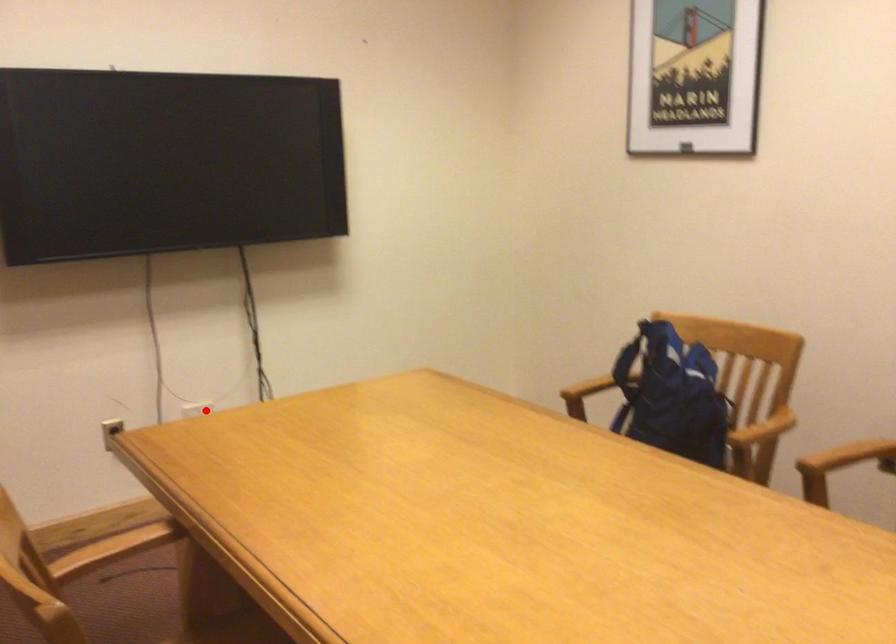
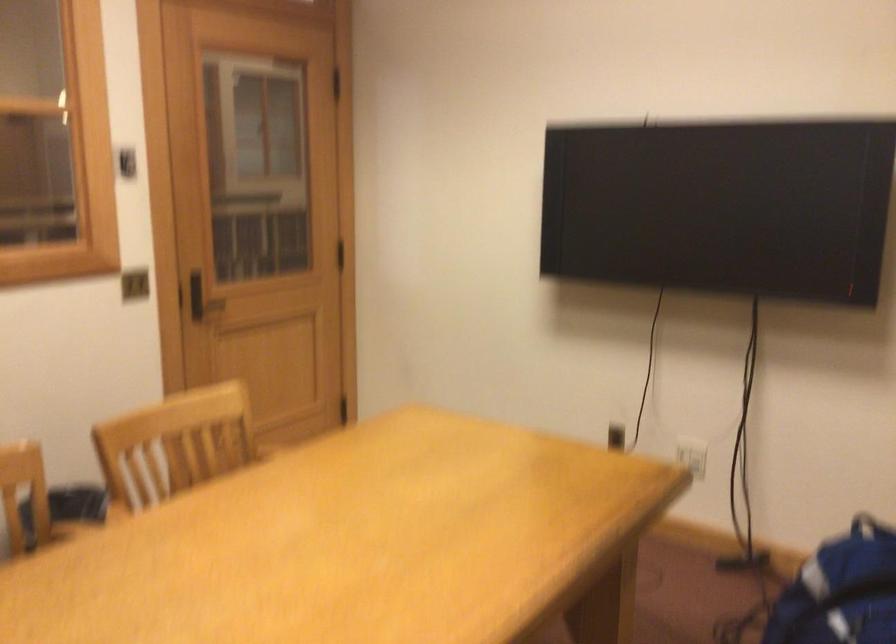
In the second image, find the point that corresponds to the highlighted location in the first image.

(692, 455)